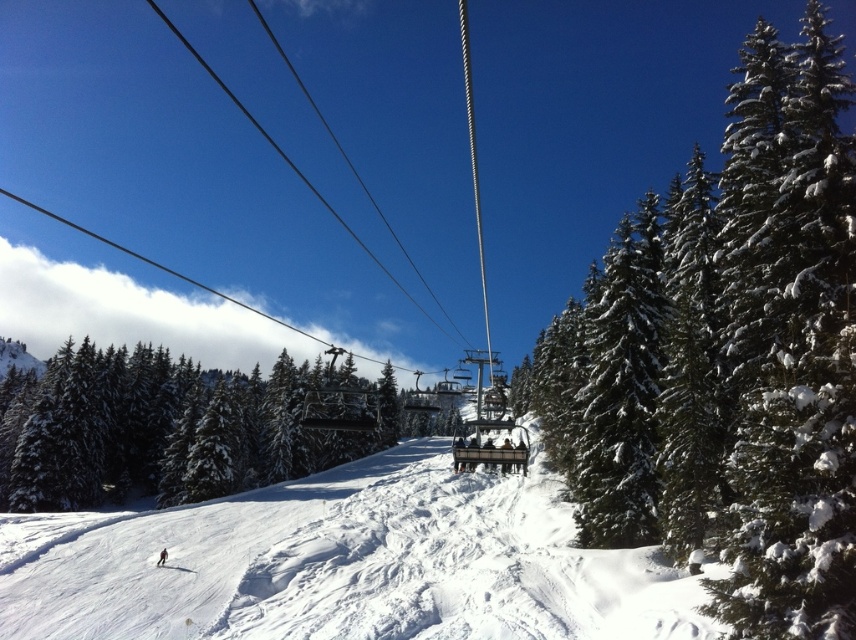
You are a ski instructor observing the scene. You see the white snowboard at lower center and the red snowboard at center. Which snowboard is positioned lower in the image?

The white snowboard at lower center is positioned lower in the image than the red snowboard at center.

You are a photographer planning to capture a photo of the white snow ski slope at center and the white snowboard at lower center. Which object should you focus on first if you want to include both in your shot without moving the camera?

The white snow ski slope at center is much taller than the white snowboard at lower center, so you should focus on the white snow ski slope at center first to ensure it fits within the frame.

You are a photographer standing at the base of the mountain, aiming to capture the two points in the scene. Which point, point (x=313, y=378) or point (x=162, y=548), is closer to your camera lens?

Point (x=162, y=548) is closer to the camera lens because it is positioned nearer to the photographer compared to point (x=313, y=378), which is further away.